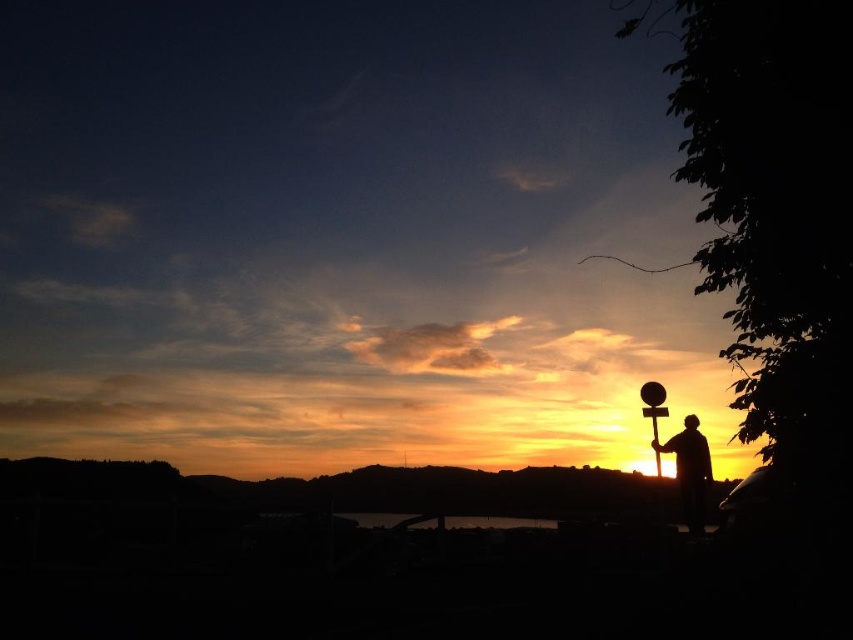
You are standing at the point with coordinates point (691, 449) and want to walk to the point with coordinates point (428, 522). Can you see the destination point from your current position?

Point (691, 449) is behind point (428, 522), so you cannot see the destination point from your current position.

You are a photographer trying to capture the sunset scene. You notice the silhouette figure at right and the dark reflective water at center. Which object should you focus on first if you want to prioritize capturing the taller one?

The silhouette figure at right is taller than the dark reflective water at center, so you should focus on the silhouette figure at right first.

You are an autonomous drone navigating the sunset scene. Your mission is to fly from the bottom left corner to the top right corner without entering a restricted zone. The restricted zone is a circle with a radius of 0.1 centered at the silhouette figure at right. Can you safely complete the mission?

The silhouette figure at right is located at point (689,470). The restricted zone has a radius of 0.1, so the drone can safely navigate around this area by staying outside the circle centered at (689,470) with radius 0.1 while moving from the bottom left to the top right corner.